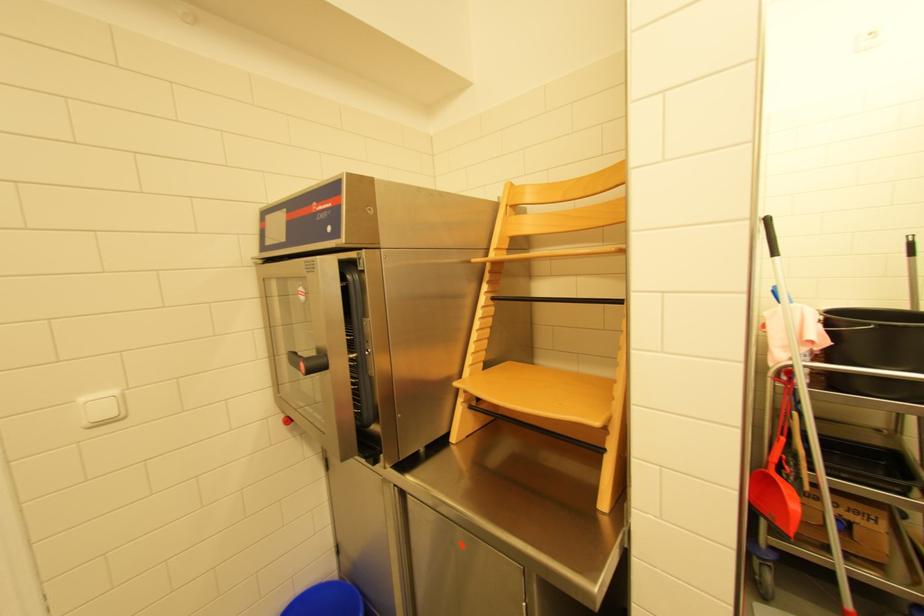
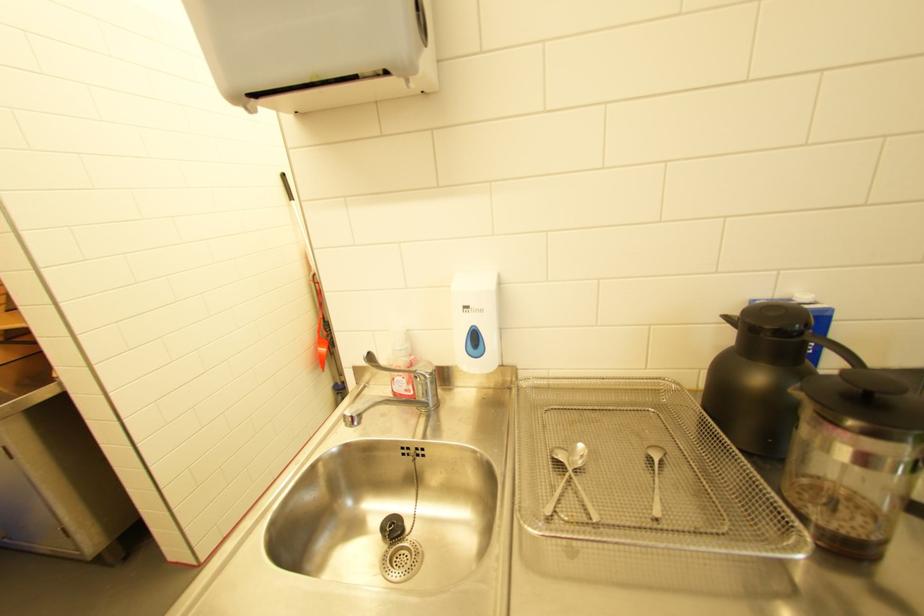
Question: I am providing you with two images of the same scene from different viewpoints. After the viewpoint changes to image2, which objects are now occluded?

Choices:
 (A) small metal spoon
 (B) black bucket
 (C) black sink plug
 (D) paper map

Answer: (B)